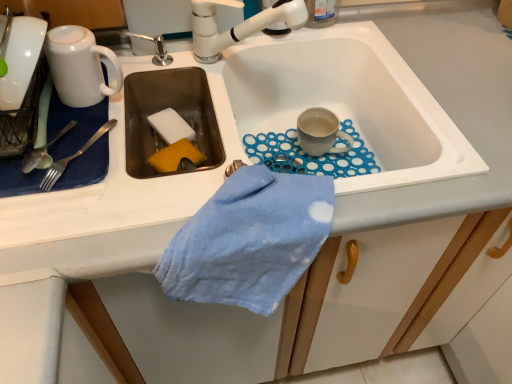
You are a GUI agent. You are given a task and a screenshot of the screen. Output one action in this format:
    pyautogui.click(x=<x>, y=<y>)
    Task: Click on the unoccupied area behind satin silver fork at left, which is the third silverware from left to right
    Image resolution: width=512 pixels, height=384 pixels.
    Given the screenshot: What is the action you would take?
    pyautogui.click(x=111, y=102)